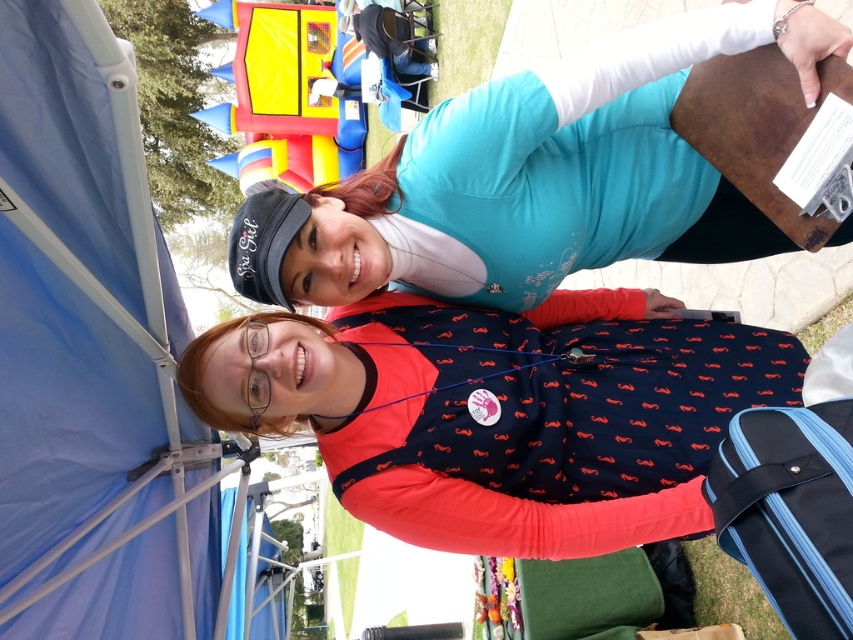
Question: Does navy blue fabric with orange mustache pattern at center appear on the left side of teal matte shirt at upper center?

Choices:
 (A) yes
 (B) no

Answer: (A)

Question: Can you confirm if blue fabric canopy at upper left is positioned above blue fabric suitcase at lower right?

Choices:
 (A) no
 (B) yes

Answer: (B)

Question: Which point is closer to the camera?

Choices:
 (A) blue fabric suitcase at lower right
 (B) teal matte shirt at upper center

Answer: (A)

Question: Is blue fabric canopy at upper left above teal matte shirt at upper center?

Choices:
 (A) yes
 (B) no

Answer: (B)

Question: Which object appears closest to the camera in this image?

Choices:
 (A) teal matte shirt at upper center
 (B) navy blue fabric with orange mustache pattern at center
 (C) blue fabric suitcase at lower right
 (D) blue fabric canopy at upper left

Answer: (D)

Question: Which point is farther to the camera?

Choices:
 (A) (804, 458)
 (B) (80, 417)
 (C) (486, 422)
 (D) (663, 84)

Answer: (D)